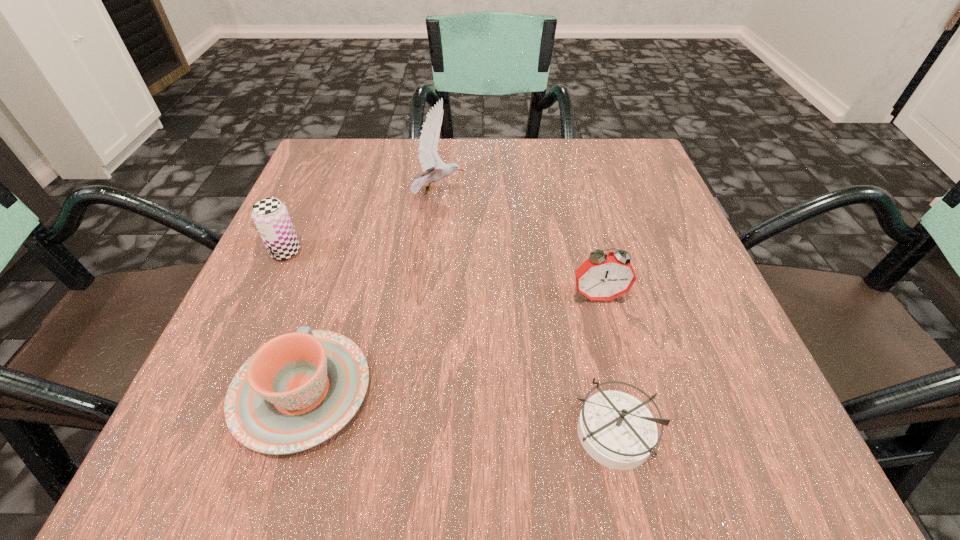
The width and height of the screenshot is (960, 540). Find the location of `vacant space at the far edge of the desktop`. vacant space at the far edge of the desktop is located at coordinates (569, 147).

Locate an element on the screen. This screenshot has width=960, height=540. vacant space at the near edge of the desktop is located at coordinates (337, 434).

Where is `vacant space at the left edge of the desktop`? vacant space at the left edge of the desktop is located at coordinates (357, 233).

I want to click on vacant region at the right edge of the desktop, so click(647, 237).

The height and width of the screenshot is (540, 960). Find the location of `free region at the far left corner of the desktop`. free region at the far left corner of the desktop is located at coordinates click(x=330, y=150).

In the image, there is a desktop. Where is `free space at the near left corner`? The image size is (960, 540). free space at the near left corner is located at coordinates (170, 464).

In the image, there is a desktop. Identify the location of vacant area at the far right corner. (581, 147).

Locate an element on the screen. The image size is (960, 540). free space between the chinaware and the third object from right to left is located at coordinates (370, 293).

I want to click on unoccupied area between the beer can and the compass, so pos(449,342).

Locate an element on the screen. vacant space that's between the compass and the second farthest object is located at coordinates (449, 342).